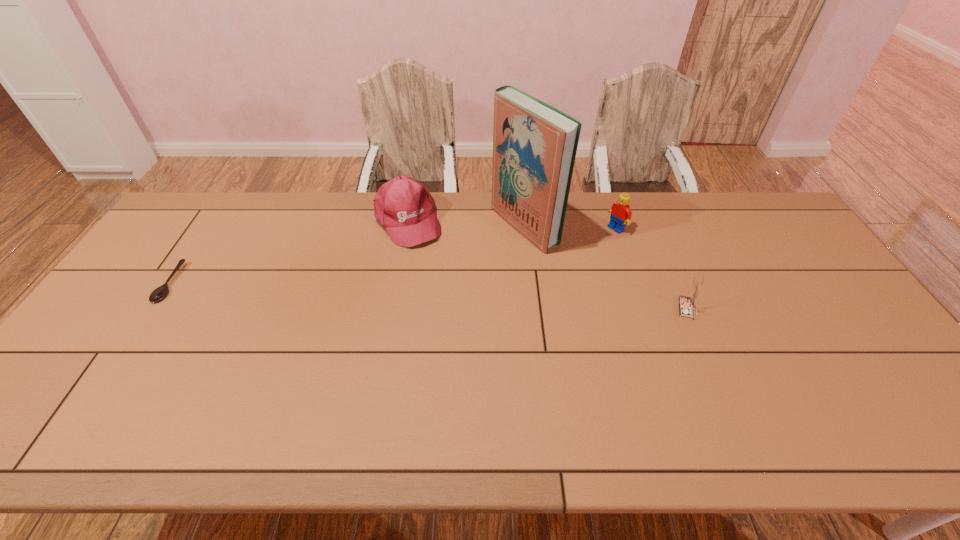
Find the location of `vacant space located 0.200m at the front of the fourth object from right to left with the brim`. vacant space located 0.200m at the front of the fourth object from right to left with the brim is located at coordinates (444, 288).

Locate an element on the screen. free space located at the front of the fourth object from right to left with the brim is located at coordinates (474, 338).

Locate an element on the screen. free region located 0.130m on the cover of the third object from right to left is located at coordinates (466, 259).

In order to click on free region located 0.200m on the cover of the third object from right to left in this screenshot , I will do `click(446, 268)`.

Find the location of a particular element. The height and width of the screenshot is (540, 960). free space located on the cover of the third object from right to left is located at coordinates (481, 251).

I want to click on free spot located 0.380m on the face of the second object from right to left, so click(523, 285).

Where is `free space located 0.250m on the face of the second object from right to left`? The width and height of the screenshot is (960, 540). free space located 0.250m on the face of the second object from right to left is located at coordinates click(x=555, y=266).

You are a GUI agent. You are given a task and a screenshot of the screen. Output one action in this format:
    pyautogui.click(x=<x>, y=<y>)
    Task: Click on the free point located 0.220m on the face of the second object from right to left
    
    Given the screenshot: What is the action you would take?
    pyautogui.click(x=563, y=262)

I want to click on baseball cap that is at the far edge, so click(x=404, y=207).

Locate an element on the screen. This screenshot has height=540, width=960. hardback book located in the far edge section of the desktop is located at coordinates (534, 144).